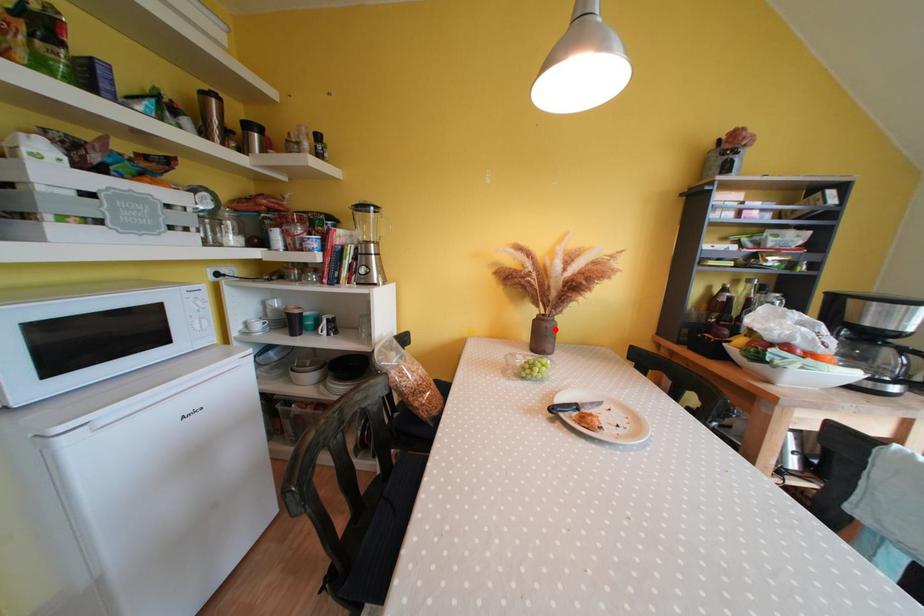
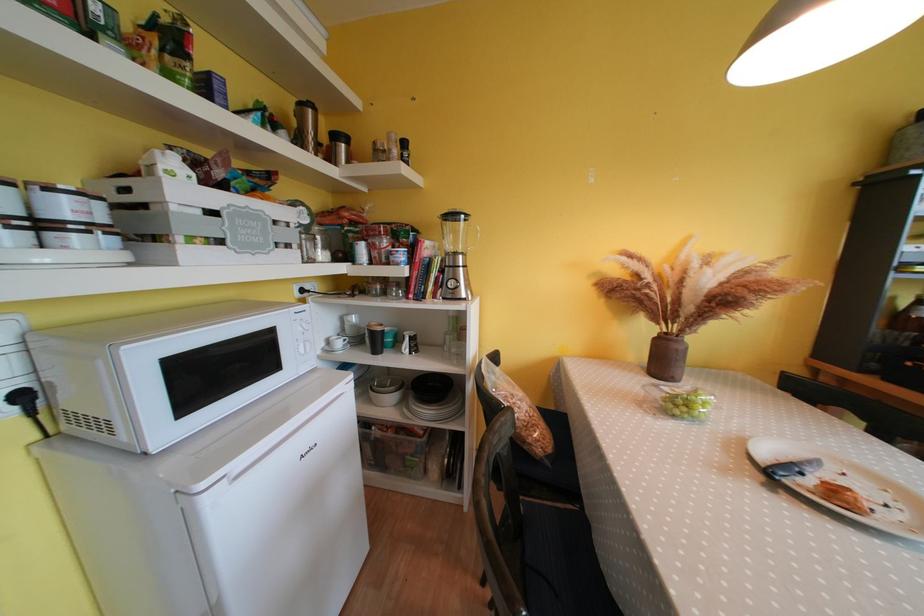
Locate, in the second image, the point that corresponds to the highlighted location in the first image.

(687, 351)